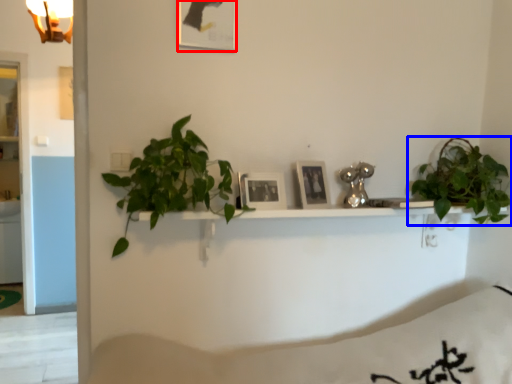
Question: Which of the following is the farthest to the observer, picture frame (highlighted by a red box) or houseplant (highlighted by a blue box)?

Choices:
 (A) picture frame
 (B) houseplant

Answer: (B)